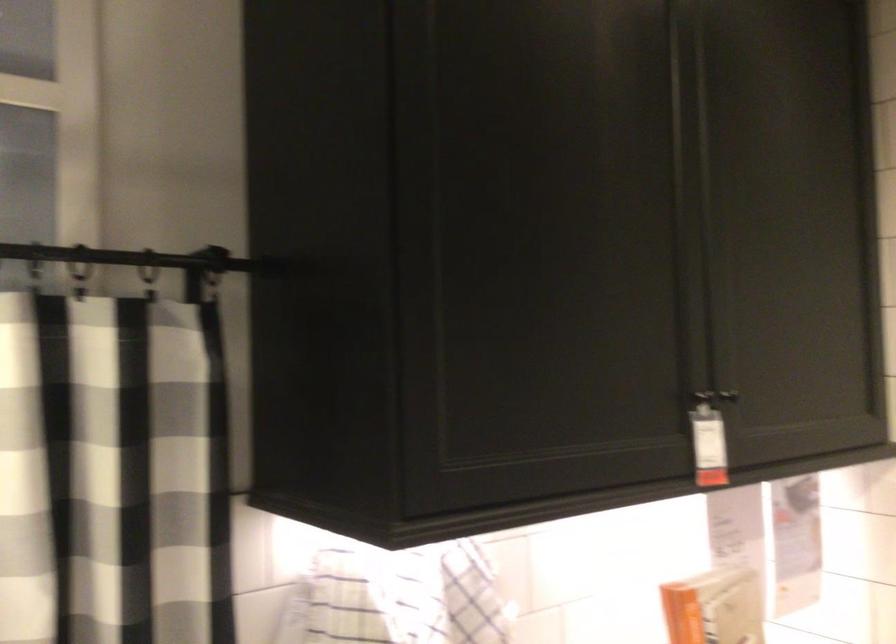
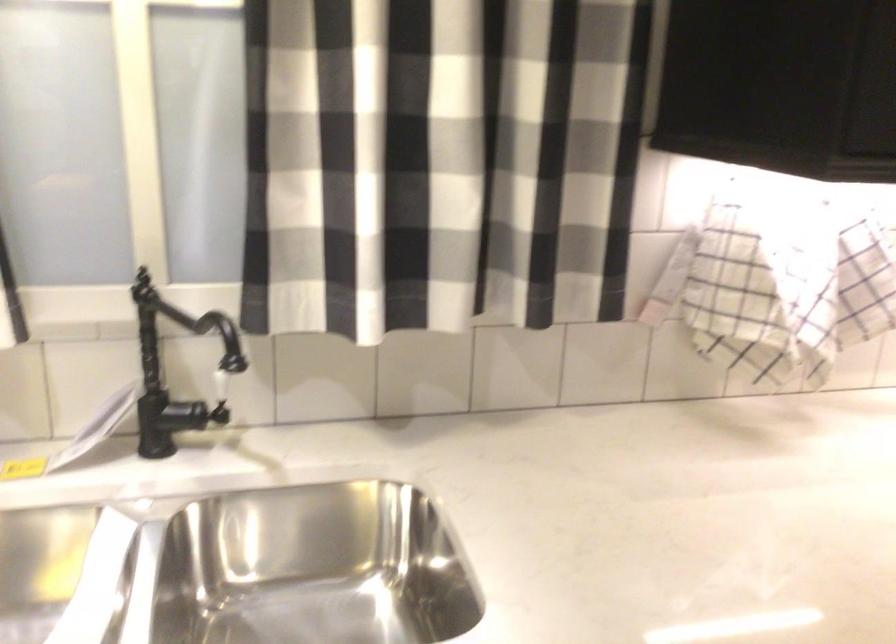
The first image is from the beginning of the video and the second image is from the end. How did the camera likely rotate when shooting the video?

The camera's rotation is toward left-down.